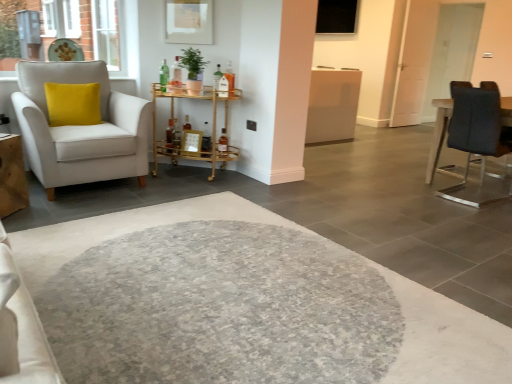
Question: Does matte white armchair at left have a larger size compared to gold metallic bar cart at center, acting as the first table starting from the left?

Choices:
 (A) yes
 (B) no

Answer: (A)

Question: Is matte white armchair at left looking in the opposite direction of gold metallic bar cart at center, acting as the first table starting from the left?

Choices:
 (A) no
 (B) yes

Answer: (A)

Question: From the image's perspective, is matte white armchair at left on top of gold metallic bar cart at center, acting as the first table starting from the left?

Choices:
 (A) yes
 (B) no

Answer: (B)

Question: Is matte white armchair at left to the right of gold metallic bar cart at center, the 2th table in the right-to-left sequence, from the viewer's perspective?

Choices:
 (A) yes
 (B) no

Answer: (B)

Question: From a real-world perspective, is matte white armchair at left on top of gold metallic bar cart at center, the 2th table in the right-to-left sequence?

Choices:
 (A) no
 (B) yes

Answer: (B)

Question: Is matte white armchair at left shorter than gold metallic bar cart at center, acting as the first table starting from the left?

Choices:
 (A) yes
 (B) no

Answer: (B)

Question: Is the depth of gold metallic bar cart at center, the 2th table in the right-to-left sequence, less than that of yellow velvet pillow at left?

Choices:
 (A) no
 (B) yes

Answer: (A)

Question: Does gold metallic bar cart at center, the 2th table in the right-to-left sequence, appear on the left side of yellow velvet pillow at left?

Choices:
 (A) yes
 (B) no

Answer: (B)

Question: Is yellow velvet pillow at left located within gold metallic bar cart at center, the 2th table in the right-to-left sequence?

Choices:
 (A) no
 (B) yes

Answer: (A)

Question: Is gold metallic bar cart at center, acting as the first table starting from the left, to the right of yellow velvet pillow at left from the viewer's perspective?

Choices:
 (A) yes
 (B) no

Answer: (A)

Question: Are gold metallic bar cart at center, acting as the first table starting from the left, and yellow velvet pillow at left located far from each other?

Choices:
 (A) yes
 (B) no

Answer: (B)

Question: Considering the relative sizes of gold metallic bar cart at center, the 2th table in the right-to-left sequence, and yellow velvet pillow at left in the image provided, is gold metallic bar cart at center, the 2th table in the right-to-left sequence, taller than yellow velvet pillow at left?

Choices:
 (A) no
 (B) yes

Answer: (B)

Question: From a real-world perspective, is brick wall at upper left located higher than matte glass bottle at center?

Choices:
 (A) yes
 (B) no

Answer: (A)